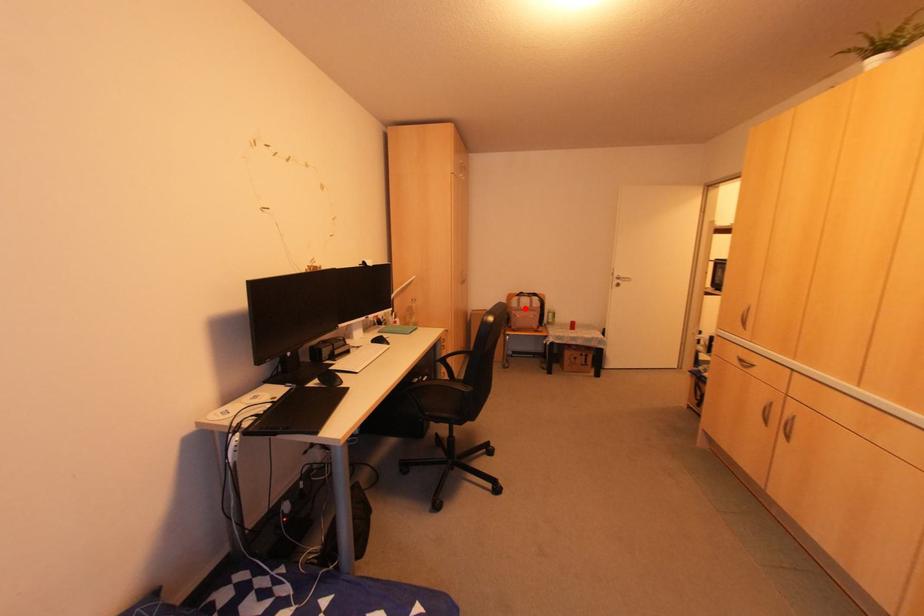
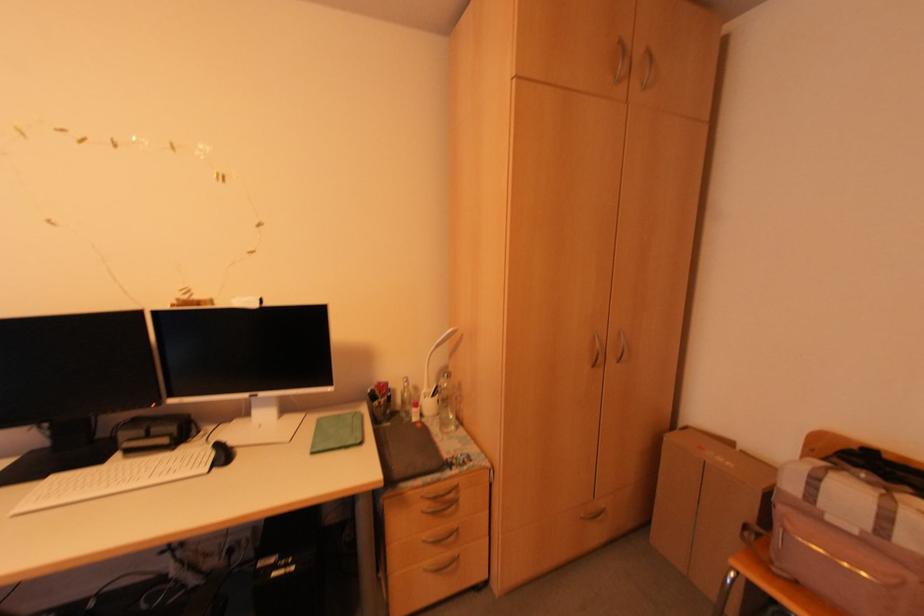
The point at the highlighted location is marked in the first image. Where is the corresponding point in the second image?

(854, 532)